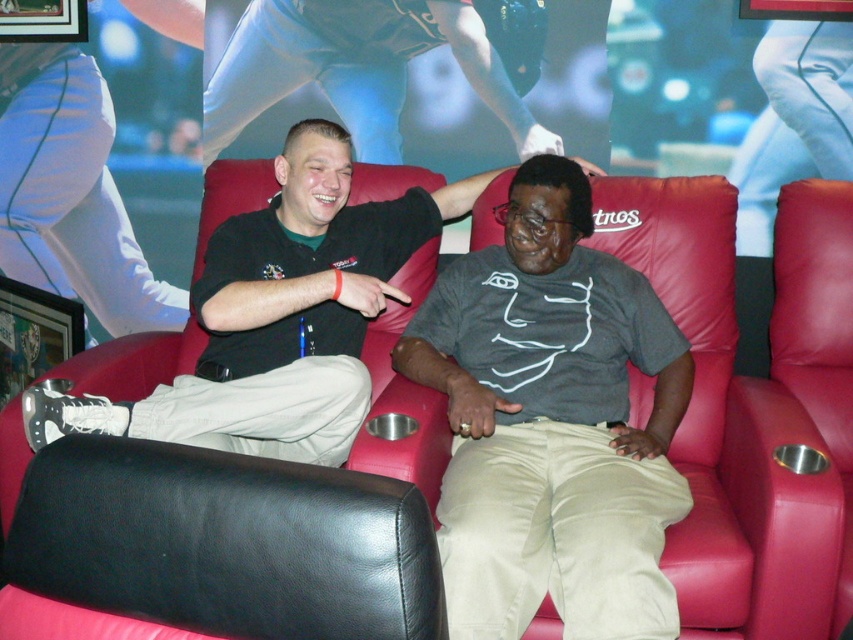
From the picture: Between leather armchair at center and matte black shirt at upper center, which one is positioned higher?

matte black shirt at upper center is above.

Between leather armchair at center and matte black shirt at upper center, which one is positioned lower?

leather armchair at center is below.

Where is `leather armchair at center`? The image size is (853, 640). leather armchair at center is located at coordinates (231, 528).

Is black matte shirt at center shorter than matte black shirt at upper center?

Incorrect, black matte shirt at center's height does not fall short of matte black shirt at upper center's.

Is point (315, 129) farther from viewer compared to point (422, 44)?

No, (315, 129) is closer to viewer.

Is point (329, 125) in front of point (225, 52)?

Yes, it is.

The image size is (853, 640). Identify the location of black matte shirt at center. (279, 316).

Is the position of khaki cotton pants at center more distant than that of black matte shirt at center?

No.

Is point (480, 252) farther from viewer compared to point (216, 262)?

Yes, it is behind point (216, 262).

Measure the distance between point [468,372] and camera.

Point [468,372] is 6.40 feet away from camera.

The width and height of the screenshot is (853, 640). In order to click on khaki cotton pants at center in this screenshot , I will do `click(550, 422)`.